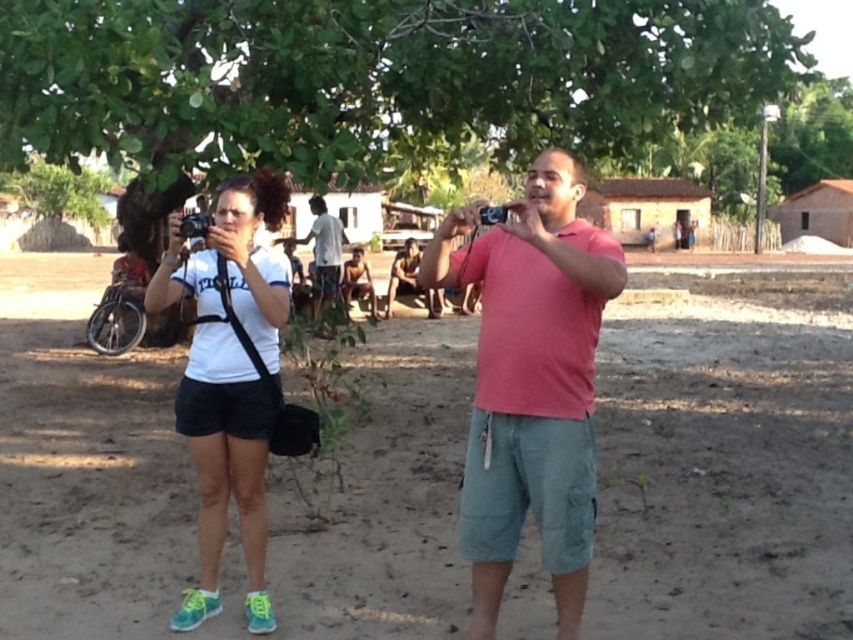
Can you confirm if dirt field at center is bigger than white matte shirt at center?

Indeed, dirt field at center has a larger size compared to white matte shirt at center.

Which is above, dirt field at center or white matte shirt at center?

Positioned higher is white matte shirt at center.

Does point (630, 595) come in front of point (213, 460)?

No, it is behind (213, 460).

This screenshot has width=853, height=640. What are the coordinates of `dirt field at center` in the screenshot? It's located at (724, 465).

Is point (508, 292) behind point (314, 218)?

No, (508, 292) is in front of (314, 218).

Who is taller, pink cotton shirt at center or light brown wooden stick at center?

light brown wooden stick at center is taller.

Image resolution: width=853 pixels, height=640 pixels. What do you see at coordinates (531, 381) in the screenshot?
I see `pink cotton shirt at center` at bounding box center [531, 381].

Identify the location of pink cotton shirt at center. (531, 381).

Looking at this image, can you confirm if dirt field at center is bigger than green leafy tree at center?

Indeed, dirt field at center has a larger size compared to green leafy tree at center.

Does dirt field at center have a greater width compared to green leafy tree at center?

Yes.

I want to click on dirt field at center, so click(724, 465).